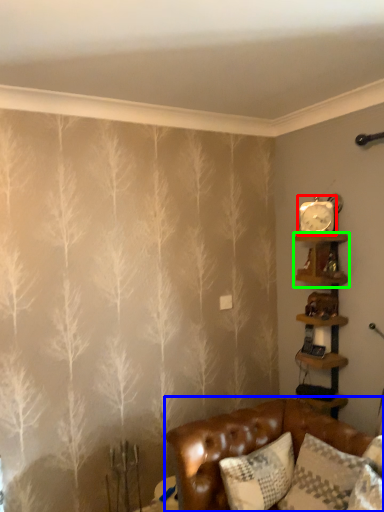
Question: Which object is positioned closest to clock (highlighted by a red box)? Select from studio couch (highlighted by a blue box) and shelf (highlighted by a green box).

Choices:
 (A) studio couch
 (B) shelf

Answer: (B)